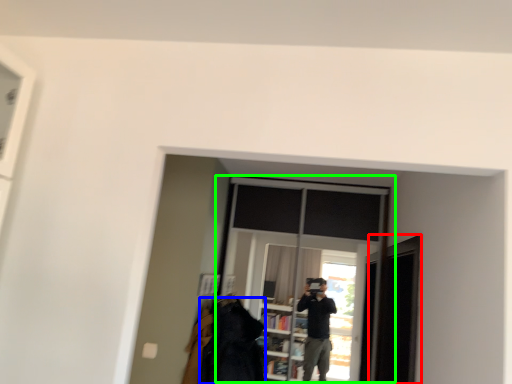
Question: Which object is the closest to the screen door (highlighted by a red box)? Choose among these: clothing (highlighted by a blue box) or window (highlighted by a green box).

Choices:
 (A) clothing
 (B) window

Answer: (B)